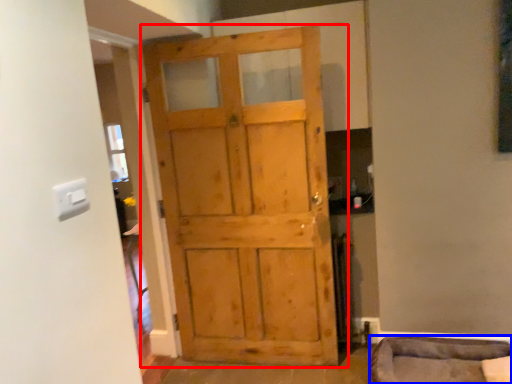
Question: Which object appears farthest to the camera in this image, door (highlighted by a red box) or furniture (highlighted by a blue box)?

Choices:
 (A) door
 (B) furniture

Answer: (A)